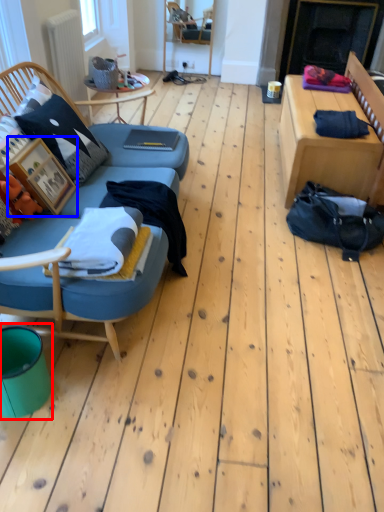
Question: Which object is closer to the camera taking this photo, teal (highlighted by a red box) or picture frame (highlighted by a blue box)?

Choices:
 (A) teal
 (B) picture frame

Answer: (A)